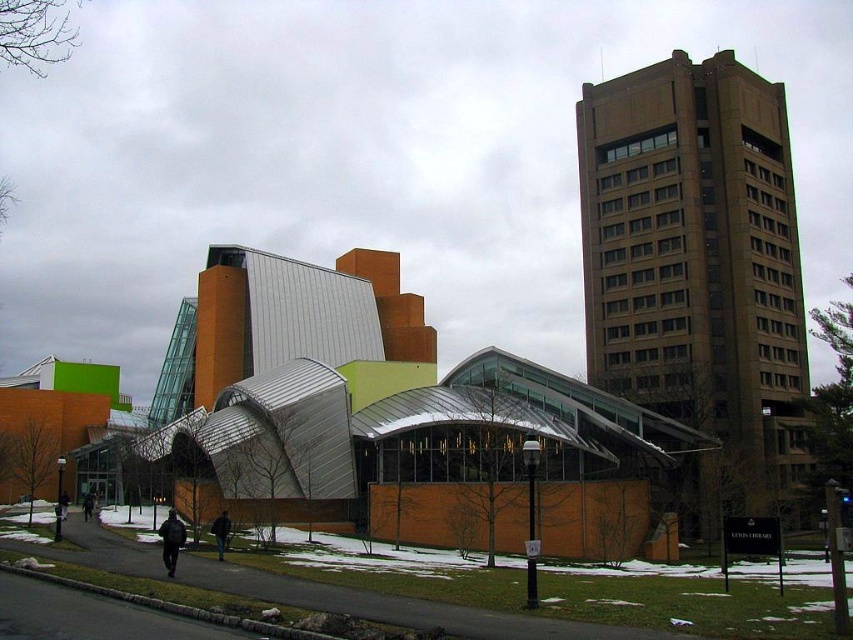
Can you confirm if dark blue jacket at lower center is positioned to the right of dark gray jacket at lower left?

Correct, you'll find dark blue jacket at lower center to the right of dark gray jacket at lower left.

Does dark blue jacket at lower center appear over dark gray jacket at lower left?

Yes.

Between point (223, 518) and point (59, 504), which one is positioned in front?

Point (223, 518) is in front.

Image resolution: width=853 pixels, height=640 pixels. What are the coordinates of `dark blue jacket at lower center` in the screenshot? It's located at (219, 532).

Is black leather jacket at lower left smaller than dark blue jacket at lower center?

Incorrect, black leather jacket at lower left is not smaller in size than dark blue jacket at lower center.

Who is more distant from viewer, (x=173, y=529) or (x=224, y=545)?

Positioned behind is point (x=224, y=545).

At what (x,y) coordinates should I click in order to perform the action: click on black leather jacket at lower left. Please return your answer as a coordinate pair (x, y). This screenshot has height=640, width=853. Looking at the image, I should click on (171, 540).

Does brown brick building at upper right come in front of dark gray jacket at lower left?

No.

Between point (583, 236) and point (65, 492), which one is positioned behind?

Positioned behind is point (583, 236).

Identify the location of brown brick building at upper right. The image size is (853, 640). (698, 268).